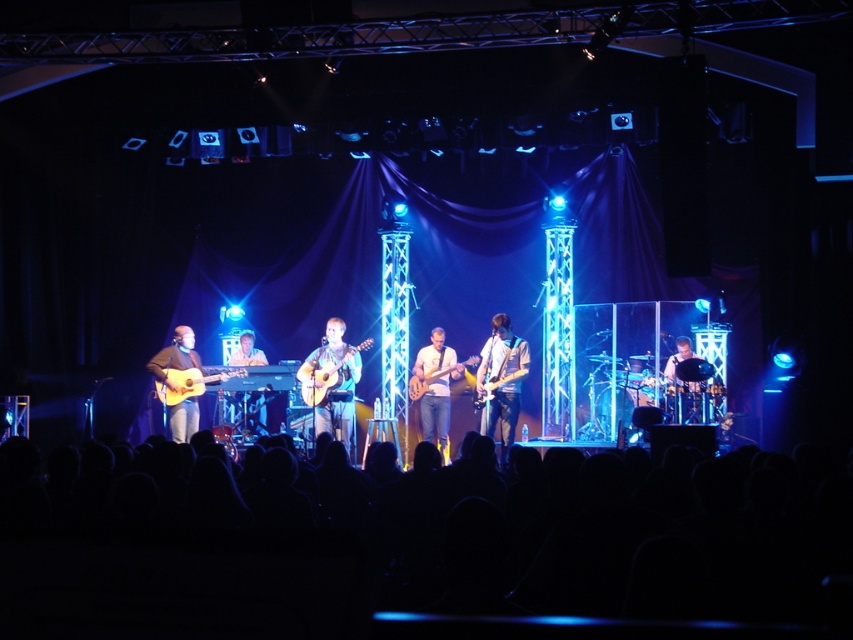
You are a photographer at the concert. You want to capture a photo of both the matte brown acoustic guitar at center and the glossy electric guitar at center. Which guitar should you focus on first if you want to ensure both are in the frame without moving the camera?

The matte brown acoustic guitar at center is positioned under the glossy electric guitar at center, so focusing on the glossy electric guitar at center first will ensure both guitars are in the frame without needing to adjust the camera position.

You are a photographer at the concert and want to capture the shiny silver guitar at center. Given that the guitar is represented by the point with coordinates point [502,378], what is the exact coordinate of the guitar?

The shiny silver guitar at center has coordinates point [502,378].

You are a stagehand who needs to move a 1.5 meter long equipment case from the back of the stage to the front. The path between the shiny silver guitar at center and the black drum at center is your only route. Can you safely navigate the case through this path without hitting either the guitar or the drum?

The shiny silver guitar at center is 1.60 meters away from the black drum at center. Since the equipment case is 1.5 meters long, it can fit within the space between them without touching either instrument, so the path is safe to navigate.